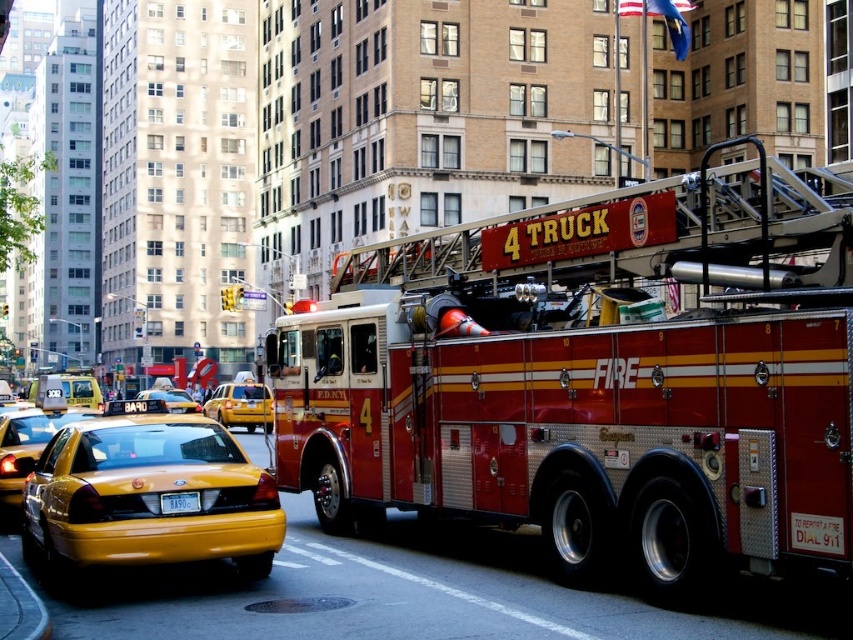
Question: Considering the relative positions of yellow rubber taxi cab at center and yellow rubber taxi at center in the image provided, where is yellow rubber taxi cab at center located with respect to yellow rubber taxi at center?

Choices:
 (A) above
 (B) below

Answer: (B)

Question: Does yellow rubber taxi cab at center lie in front of yellow glossy taxi at center?

Choices:
 (A) no
 (B) yes

Answer: (A)

Question: Which object is positioned farthest from the yellow rubber taxi at center?

Choices:
 (A) yellow matte taxi at lower left
 (B) yellow glossy taxi cab at lower left
 (C) yellow plastic license plate at lower center
 (D) yellow rubber taxi cab at center

Answer: (B)

Question: Which object is the closest to the yellow rubber taxi at center?

Choices:
 (A) yellow matte taxi at lower left
 (B) yellow glossy taxi at center

Answer: (A)

Question: Which point is closer to the camera?

Choices:
 (A) (49, 577)
 (B) (96, 385)
 (C) (9, 458)
 (D) (155, 392)

Answer: (A)

Question: Is shiny red fire truck at center wider than yellow plastic license plate at lower center?

Choices:
 (A) yes
 (B) no

Answer: (A)